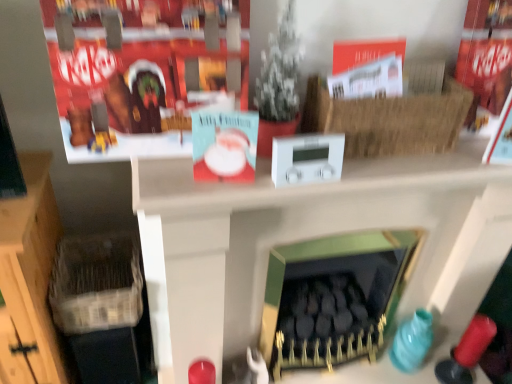
Question: Considering the relative sizes of green matte fireplace at center and woven wicker basket at lower left, the 1th basket from the bottom, in the image provided, is green matte fireplace at center taller than woven wicker basket at lower left, the 1th basket from the bottom,?

Choices:
 (A) no
 (B) yes

Answer: (B)

Question: Is green matte fireplace at center completely or partially outside of woven wicker basket at lower left, the 1th basket from the bottom?

Choices:
 (A) no
 (B) yes

Answer: (B)

Question: Does green matte fireplace at center have a lesser height compared to woven wicker basket at lower left, acting as the first basket starting from the left?

Choices:
 (A) yes
 (B) no

Answer: (B)

Question: Is green matte fireplace at center positioned behind woven wicker basket at lower left, which is the first basket in back-to-front order?

Choices:
 (A) no
 (B) yes

Answer: (A)

Question: Does green matte fireplace at center have a larger size compared to woven wicker basket at lower left, which is the first basket in back-to-front order?

Choices:
 (A) yes
 (B) no

Answer: (A)

Question: From a real-world perspective, does green matte fireplace at center sit lower than woven wicker basket at lower left, which is counted as the second basket, starting from the right?

Choices:
 (A) no
 (B) yes

Answer: (A)

Question: Is green matte fireplace at center at the right side of woven wicker basket at lower left, the 2th basket viewed from the front?

Choices:
 (A) no
 (B) yes

Answer: (B)

Question: Considering the relative sizes of green matte fireplace at center and woven wicker basket at lower left, which is the first basket in back-to-front order, in the image provided, is green matte fireplace at center taller than woven wicker basket at lower left, which is the first basket in back-to-front order,?

Choices:
 (A) yes
 (B) no

Answer: (A)

Question: Is green matte fireplace at center smaller than woven wicker basket at lower left, the 2th basket viewed from the front?

Choices:
 (A) no
 (B) yes

Answer: (A)

Question: Considering the relative sizes of green matte fireplace at center and woven wicker basket at lower left, the 1th basket from the bottom, in the image provided, is green matte fireplace at center thinner than woven wicker basket at lower left, the 1th basket from the bottom,?

Choices:
 (A) no
 (B) yes

Answer: (A)

Question: From a real-world perspective, is green matte fireplace at center on woven wicker basket at lower left, the 1th basket from the bottom?

Choices:
 (A) no
 (B) yes

Answer: (A)

Question: Would you say green matte fireplace at center is a long distance from woven wicker basket at lower left, acting as the first basket starting from the left?

Choices:
 (A) yes
 (B) no

Answer: (B)

Question: Would you say green matte fireplace at center is outside red cardboard box at upper left?

Choices:
 (A) no
 (B) yes

Answer: (B)